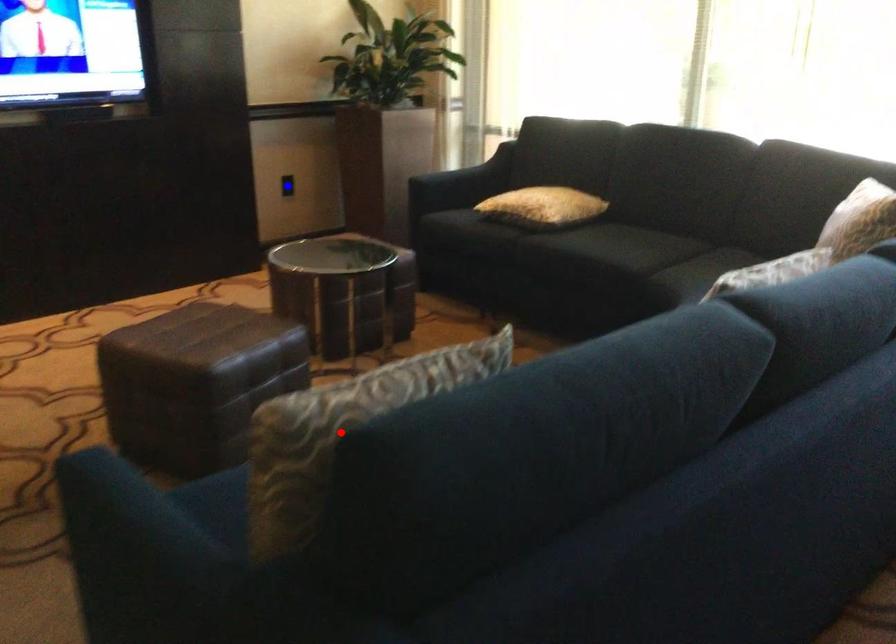
Question: In the image, two points are highlighted. Which point is nearer to the camera? Reply with the corresponding letter.

Choices:
 (A) blue point
 (B) red point

Answer: (B)